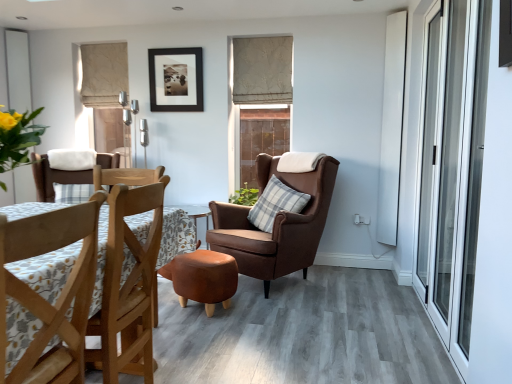
Question: Is leather ottoman at center to the left or to the right of green leafy plant at center in the image?

Choices:
 (A) left
 (B) right

Answer: (A)

Question: Based on their sizes in the image, would you say leather ottoman at center is bigger or smaller than green leafy plant at center?

Choices:
 (A) big
 (B) small

Answer: (A)

Question: Considering the real-world distances, which object is closest to the brown wooden chair at center, arranged as the 2th window when viewed from the left?

Choices:
 (A) green leafy plant at center
 (B) leather ottoman at center
 (C) white matte window at upper left, the second window when ordered from right to left
 (D) wooden chair at lower left, which is counted as the second chair, starting from the left
 (E) black matte picture frame at upper center

Answer: (A)

Question: Which of these objects is positioned closest to the wooden chair at center, marked as the first chair in a back-to-front arrangement?

Choices:
 (A) green leafy plant at center
 (B) beige fabric curtain at upper left, the first curtain positioned from the left
 (C) beige textured curtain at upper center, the 1th curtain when ordered from right to left
 (D) plaid fabric pillow at center
 (E) white matte window at upper left, the 1th window from the left

Answer: (B)